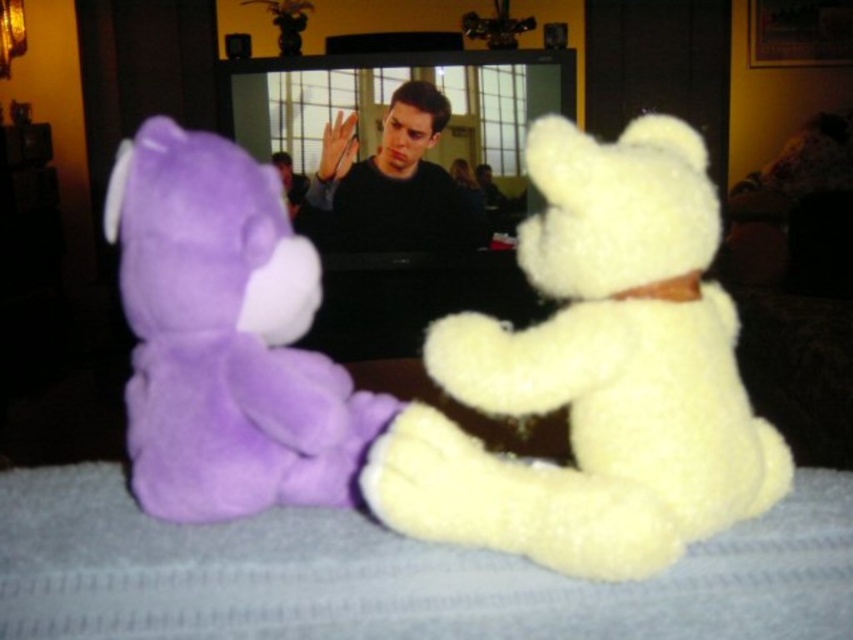
Question: Can you confirm if white fluffy teddy bear at center is positioned to the right of matte black shirt at center?

Choices:
 (A) yes
 (B) no

Answer: (A)

Question: Which object is closer to the camera taking this photo?

Choices:
 (A) purple plush bear at left
 (B) matte black shirt at center

Answer: (A)

Question: Observing the image, what is the correct spatial positioning of matte black sweater at center in reference to matte black shirt at center?

Choices:
 (A) right
 (B) left

Answer: (A)

Question: Can you confirm if purple plush bear at left is wider than matte black shirt at center?

Choices:
 (A) yes
 (B) no

Answer: (A)

Question: Which of these objects is positioned farthest from the purple plush bear at left?

Choices:
 (A) matte black sweater at center
 (B) white fluffy teddy bear at center

Answer: (A)

Question: Which point is farther to the camera?

Choices:
 (A) matte black sweater at center
 (B) white fluffy teddy bear at center
 (C) matte black shirt at center
 (D) purple plush bear at left

Answer: (C)